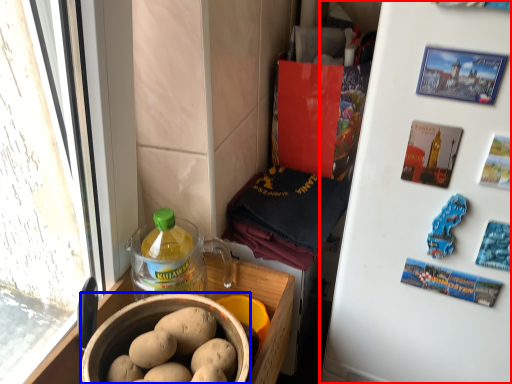
Question: Which object appears closest to the camera in this image, refrigerator (highlighted by a red box) or bowl (highlighted by a blue box)?

Choices:
 (A) refrigerator
 (B) bowl

Answer: (A)